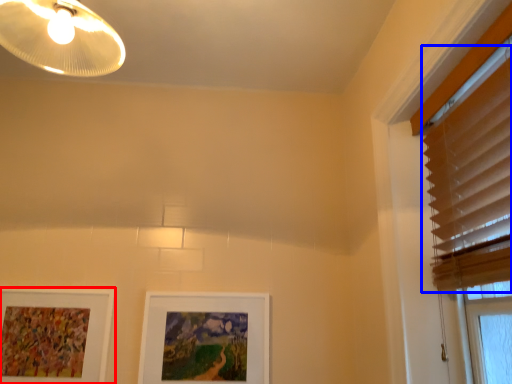
Question: Which object is further to the camera taking this photo, picture frame (highlighted by a red box) or blind (highlighted by a blue box)?

Choices:
 (A) picture frame
 (B) blind

Answer: (A)